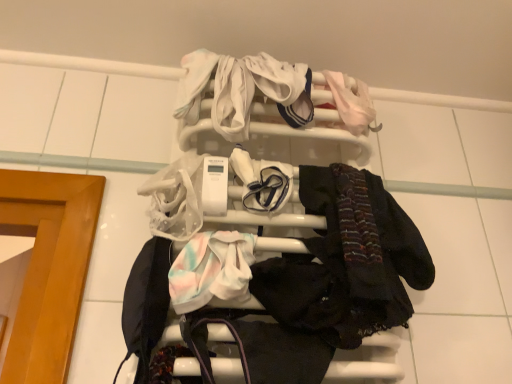
Question: From a real-world perspective, is pastel tie-dye fabric at center, placed as the first baby clothe when sorted from left to right, beneath dark matte scarf at center right?

Choices:
 (A) no
 (B) yes

Answer: (B)

Question: Does pastel tie-dye fabric at center, the third baby clothe in the right-to-left sequence, have a larger size compared to dark matte scarf at center right?

Choices:
 (A) yes
 (B) no

Answer: (B)

Question: Is pastel tie-dye fabric at center, positioned as the third baby clothe in back-to-front order, positioned with its back to dark matte scarf at center right?

Choices:
 (A) yes
 (B) no

Answer: (B)

Question: Does pastel tie-dye fabric at center, the 3th baby clothe viewed from the top, have a greater height compared to dark matte scarf at center right?

Choices:
 (A) yes
 (B) no

Answer: (B)

Question: Considering the relative positions of pastel tie-dye fabric at center, the 3th baby clothe viewed from the top, and dark matte scarf at center right in the image provided, is pastel tie-dye fabric at center, the 3th baby clothe viewed from the top, to the left of dark matte scarf at center right from the viewer's perspective?

Choices:
 (A) yes
 (B) no

Answer: (A)

Question: Considering the relative sizes of pastel tie-dye fabric at center, the third baby clothe in the right-to-left sequence, and dark matte scarf at center right in the image provided, is pastel tie-dye fabric at center, the third baby clothe in the right-to-left sequence, shorter than dark matte scarf at center right?

Choices:
 (A) no
 (B) yes

Answer: (B)

Question: Considering the relative positions of dark matte scarf at center right and white soft fabric at center, the second baby clothe in the back-to-front sequence, in the image provided, is dark matte scarf at center right to the right of white soft fabric at center, the second baby clothe in the back-to-front sequence, from the viewer's perspective?

Choices:
 (A) no
 (B) yes

Answer: (B)

Question: Does dark matte scarf at center right lie behind white soft fabric at center, acting as the 2th baby clothe starting from the right?

Choices:
 (A) yes
 (B) no

Answer: (B)

Question: Is dark matte scarf at center right not within white soft fabric at center, acting as the 2th baby clothe starting from the right?

Choices:
 (A) no
 (B) yes

Answer: (B)

Question: Is dark matte scarf at center right surrounding white soft fabric at center, which is the 2th baby clothe in top-to-bottom order?

Choices:
 (A) no
 (B) yes

Answer: (A)

Question: Is dark matte scarf at center right wider than white soft fabric at center, the 2th baby clothe from the bottom?

Choices:
 (A) no
 (B) yes

Answer: (B)

Question: From the image's perspective, does dark matte scarf at center right appear higher than white soft fabric at center, acting as the 2th baby clothe starting from the right?

Choices:
 (A) no
 (B) yes

Answer: (A)

Question: From a real-world perspective, is white soft fabric at center, the 2th baby clothe when ordered from left to right, physically above white plastic towel rack at upper center?

Choices:
 (A) no
 (B) yes

Answer: (A)